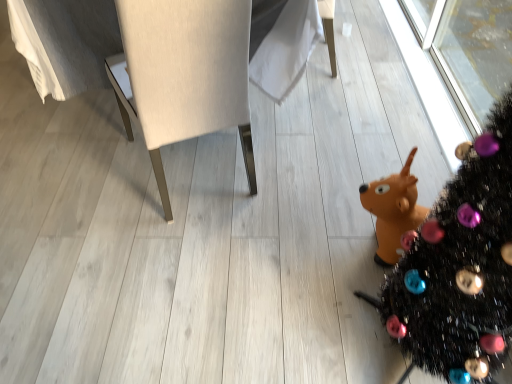
From the picture: What is the approximate height of matte white chair at center?

It is 36.08 inches.

What do you see at coordinates (124, 93) in the screenshot? Image resolution: width=512 pixels, height=384 pixels. I see `matte white chair at center` at bounding box center [124, 93].

The image size is (512, 384). What are the coordinates of `matte white chair at center` in the screenshot? It's located at (124, 93).

What do you see at coordinates (459, 267) in the screenshot?
I see `black glittery christmas tree at lower right` at bounding box center [459, 267].

The width and height of the screenshot is (512, 384). I want to click on black glittery christmas tree at lower right, so click(x=459, y=267).

The width and height of the screenshot is (512, 384). Find the location of `matte white chair at center`. matte white chair at center is located at coordinates (124, 93).

Between black glittery christmas tree at lower right and matte white chair at center, which one appears on the right side from the viewer's perspective?

black glittery christmas tree at lower right is more to the right.

Which object is closer to the camera taking this photo, black glittery christmas tree at lower right or matte white chair at center?

black glittery christmas tree at lower right.

Which point is more distant from viewer, (466, 168) or (211, 114)?

The point (211, 114) is more distant.

From the image's perspective, would you say black glittery christmas tree at lower right is shown under matte white chair at center?

Yes, from the image's perspective, black glittery christmas tree at lower right is beneath matte white chair at center.

From a real-world perspective, is black glittery christmas tree at lower right over matte white chair at center?

Correct, in the physical world, black glittery christmas tree at lower right is higher than matte white chair at center.

Consider the image. Considering the relative sizes of black glittery christmas tree at lower right and matte white chair at center in the image provided, is black glittery christmas tree at lower right wider than matte white chair at center?

No, black glittery christmas tree at lower right is not wider than matte white chair at center.

Considering the relative sizes of black glittery christmas tree at lower right and matte white chair at center in the image provided, is black glittery christmas tree at lower right taller than matte white chair at center?

Indeed, black glittery christmas tree at lower right has a greater height compared to matte white chair at center.

Looking at this image, does black glittery christmas tree at lower right have a larger size compared to matte white chair at center?

Actually, black glittery christmas tree at lower right might be smaller than matte white chair at center.

Is black glittery christmas tree at lower right not within matte white chair at center?

Yes, black glittery christmas tree at lower right is outside of matte white chair at center.

Is black glittery christmas tree at lower right next to matte white chair at center and touching it?

black glittery christmas tree at lower right and matte white chair at center are clearly separated.

Is black glittery christmas tree at lower right facing away from matte white chair at center?

No, black glittery christmas tree at lower right's orientation is not away from matte white chair at center.

Can you tell me how much black glittery christmas tree at lower right and matte white chair at center differ in facing direction?

They differ by 65.5 degrees in their facing directions.

You are a GUI agent. You are given a task and a screenshot of the screen. Output one action in this format:
    pyautogui.click(x=<x>, y=<y>)
    Task: Click on the furniture behind the black glittery christmas tree at lower right
    
    Given the screenshot: What is the action you would take?
    pyautogui.click(x=124, y=93)

Can you confirm if matte white chair at center is positioned to the right of black glittery christmas tree at lower right?

Incorrect, matte white chair at center is not on the right side of black glittery christmas tree at lower right.

Which object is further away from the camera, matte white chair at center or black glittery christmas tree at lower right?

Positioned behind is matte white chair at center.

Considering the positions of points (154, 163) and (511, 337), is point (154, 163) closer to camera compared to point (511, 337)?

No, it is not.

From the image's perspective, is matte white chair at center located above black glittery christmas tree at lower right?

Indeed, from the image's perspective, matte white chair at center is shown above black glittery christmas tree at lower right.

From a real-world perspective, relative to black glittery christmas tree at lower right, is matte white chair at center vertically above or below?

matte white chair at center is below black glittery christmas tree at lower right.

From the picture: Is matte white chair at center wider than black glittery christmas tree at lower right?

Indeed, matte white chair at center has a greater width compared to black glittery christmas tree at lower right.

Considering the sizes of objects matte white chair at center and black glittery christmas tree at lower right in the image provided, who is shorter, matte white chair at center or black glittery christmas tree at lower right?

matte white chair at center.

Does matte white chair at center have a smaller size compared to black glittery christmas tree at lower right?

No, matte white chair at center is not smaller than black glittery christmas tree at lower right.

Does matte white chair at center contain black glittery christmas tree at lower right?

No, black glittery christmas tree at lower right is not surrounded by matte white chair at center.

Are matte white chair at center and black glittery christmas tree at lower right beside each other?

No, matte white chair at center is not beside black glittery christmas tree at lower right.

Is matte white chair at center oriented away from black glittery christmas tree at lower right?

No, matte white chair at center is not facing away from black glittery christmas tree at lower right.

How distant is matte white chair at center from black glittery christmas tree at lower right?

The distance of matte white chair at center from black glittery christmas tree at lower right is 33.51 inches.

Locate an element on the screen. The image size is (512, 384). christmas tree that appears on the right of matte white chair at center is located at coordinates (459, 267).

Image resolution: width=512 pixels, height=384 pixels. Identify the location of furniture directly beneath the black glittery christmas tree at lower right (from a real-world perspective). click(124, 93).

The height and width of the screenshot is (384, 512). What are the coordinates of `furniture above the black glittery christmas tree at lower right (from the image's perspective)` in the screenshot? It's located at coord(124,93).